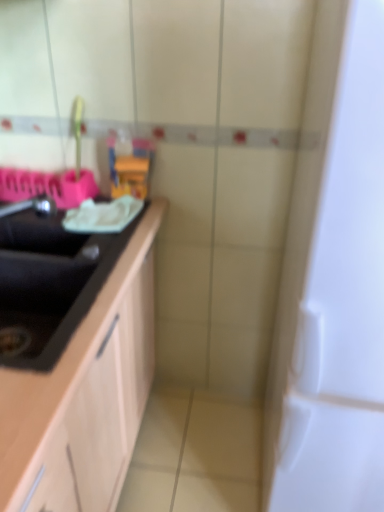
This screenshot has width=384, height=512. Describe the element at coordinates (36, 228) in the screenshot. I see `black matte sink at left` at that location.

You are a GUI agent. You are given a task and a screenshot of the screen. Output one action in this format:
    pyautogui.click(x=<x>, y=<y>)
    Task: Click on the black matte sink at left
    
    Given the screenshot: What is the action you would take?
    pyautogui.click(x=36, y=228)

Identify the location of translucent plastic toy at center. (130, 165).

I want to click on white glossy door at right, so click(333, 282).

Can you tell me how much black matte countertop at left and translucent plastic toy at center differ in facing direction?

They differ by 90.2 degrees in their facing directions.

Identify the location of toy behind the black matte countertop at left. (130, 165).

Which of these two, black matte countertop at left or translucent plastic toy at center, is thinner?

With smaller width is translucent plastic toy at center.

Is black matte countertop at left oriented towards translucent plastic toy at center?

No, black matte countertop at left is not aimed at translucent plastic toy at center.

Which is more distant, [41,199] or [21,380]?

Positioned behind is point [41,199].

From the image's perspective, is black matte sink at left located above or below black matte countertop at left?

From the image's perspective, black matte sink at left appears above black matte countertop at left.

How many degrees apart are the facing directions of black matte sink at left and black matte countertop at left?

They differ by 0.18 degrees in their facing directions.

Would you say translucent plastic toy at center is to the left or to the right of white glossy door at right in the picture?

translucent plastic toy at center is to the left of white glossy door at right.

Between translucent plastic toy at center and white glossy door at right, which one has larger width?

Wider between the two is white glossy door at right.

From a real-world perspective, which object stands above the other?

translucent plastic toy at center, from a real-world perspective.

Would you consider translucent plastic toy at center to be distant from white glossy door at right?

Actually, translucent plastic toy at center and white glossy door at right are a little close together.

The image size is (384, 512). I want to click on toy lying behind the black matte sink at left, so click(130, 165).

Is black matte sink at left oriented towards translucent plastic toy at center?

No, black matte sink at left does not turn towards translucent plastic toy at center.

Which is less distant, (17, 211) or (139, 162)?

Point (17, 211).

Are black matte sink at left and translucent plastic toy at center beside each other?

No, black matte sink at left is not next to translucent plastic toy at center.

Consider the image. Which object is more forward, translucent plastic toy at center or black matte countertop at left?

black matte countertop at left.

Considering the relative positions of translucent plastic toy at center and black matte countertop at left in the image provided, is translucent plastic toy at center to the left or to the right of black matte countertop at left?

From the image, it's evident that translucent plastic toy at center is to the right of black matte countertop at left.

Does translucent plastic toy at center contain black matte countertop at left?

That's incorrect, black matte countertop at left is not inside translucent plastic toy at center.

Is point (134, 166) closer or farther from the camera than point (103, 452)?

Point (134, 166) is farther from the camera than point (103, 452).

Could you tell me if white glossy door at right is turned towards black matte countertop at left?

No, white glossy door at right is not aimed at black matte countertop at left.

Considering the relative positions of white glossy door at right and black matte countertop at left in the image provided, is white glossy door at right to the right of black matte countertop at left from the viewer's perspective?

Yes.

Considering their positions, is white glossy door at right located in front of or behind black matte countertop at left?

In the image, white glossy door at right appears in front of black matte countertop at left.

Which of these two, black matte countertop at left or white glossy door at right, stands taller?

white glossy door at right.

Is black matte countertop at left turned away from white glossy door at right?

That's not correct — black matte countertop at left is not looking away from white glossy door at right.

Which is closer, (72, 386) or (362, 55)?

Positioned in front is point (362, 55).

The height and width of the screenshot is (512, 384). In order to click on appliance below the black matte countertop at left (from the image's perspective) in this screenshot , I will do `click(333, 282)`.

Where is `countertop lying on the left of translucent plastic toy at center`? The image size is (384, 512). countertop lying on the left of translucent plastic toy at center is located at coordinates (85, 395).

The width and height of the screenshot is (384, 512). Find the location of `countertop in front of the black matte sink at left`. countertop in front of the black matte sink at left is located at coordinates (85, 395).

Looking at the image, which one is located further to black matte countertop at left, translucent plastic toy at center or black matte sink at left?

Among the two, translucent plastic toy at center is located further to black matte countertop at left.

Which object lies nearer to the anchor point white glossy door at right, translucent plastic toy at center or black matte sink at left?

black matte sink at left.

Estimate the real-world distances between objects in this image. Which object is further from black matte countertop at left, white glossy door at right or translucent plastic toy at center?

translucent plastic toy at center.

Based on the photo, which object lies nearer to the anchor point translucent plastic toy at center, white glossy door at right or black matte sink at left?

black matte sink at left lies closer to translucent plastic toy at center than the other object.

When comparing their distances from translucent plastic toy at center, does black matte countertop at left or white glossy door at right seem further?

white glossy door at right lies further to translucent plastic toy at center than the other object.

Based on their spatial positions, is black matte countertop at left or white glossy door at right closer to black matte sink at left?

Among the two, black matte countertop at left is located nearer to black matte sink at left.

Which object lies further to the anchor point black matte sink at left, white glossy door at right or translucent plastic toy at center?

white glossy door at right is positioned further to the anchor black matte sink at left.

Which object lies nearer to the anchor point white glossy door at right, black matte countertop at left or black matte sink at left?

black matte countertop at left is closer to white glossy door at right.

You are a GUI agent. You are given a task and a screenshot of the screen. Output one action in this format:
    pyautogui.click(x=<x>, y=<y>)
    Task: Click on the countertop between black matte sink at left and white glossy door at right from left to right
    This screenshot has width=384, height=512.
    Given the screenshot: What is the action you would take?
    pyautogui.click(x=85, y=395)

Locate an element on the screen. toy between black matte countertop at left and white glossy door at right from left to right is located at coordinates (130, 165).

Where is `toy between black matte sink at left and white glossy door at right`? The image size is (384, 512). toy between black matte sink at left and white glossy door at right is located at coordinates (130, 165).

You are a GUI agent. You are given a task and a screenshot of the screen. Output one action in this format:
    pyautogui.click(x=<x>, y=<y>)
    Task: Click on the sink between black matte countertop at left and translucent plastic toy at center from front to back
    Image resolution: width=384 pixels, height=512 pixels.
    Given the screenshot: What is the action you would take?
    pyautogui.click(x=36, y=228)